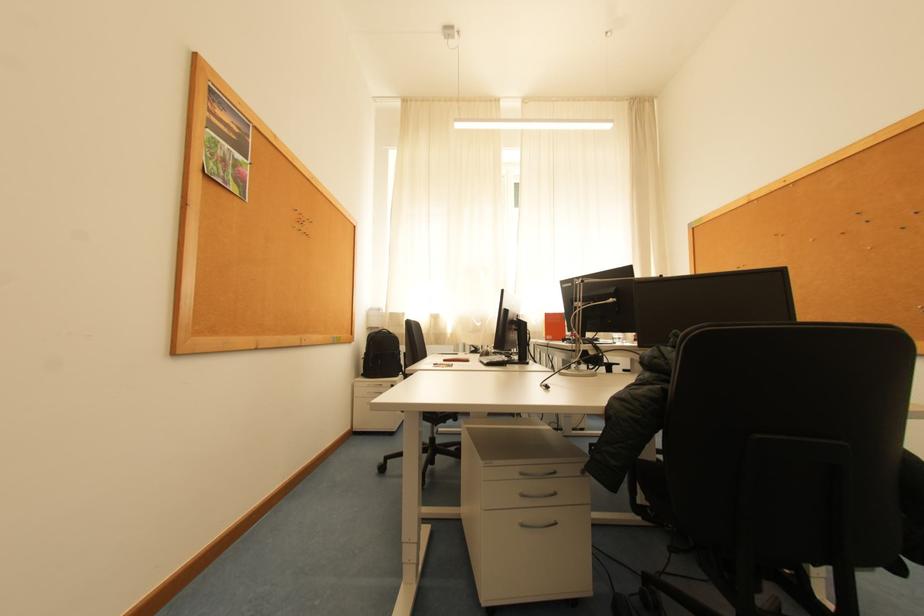
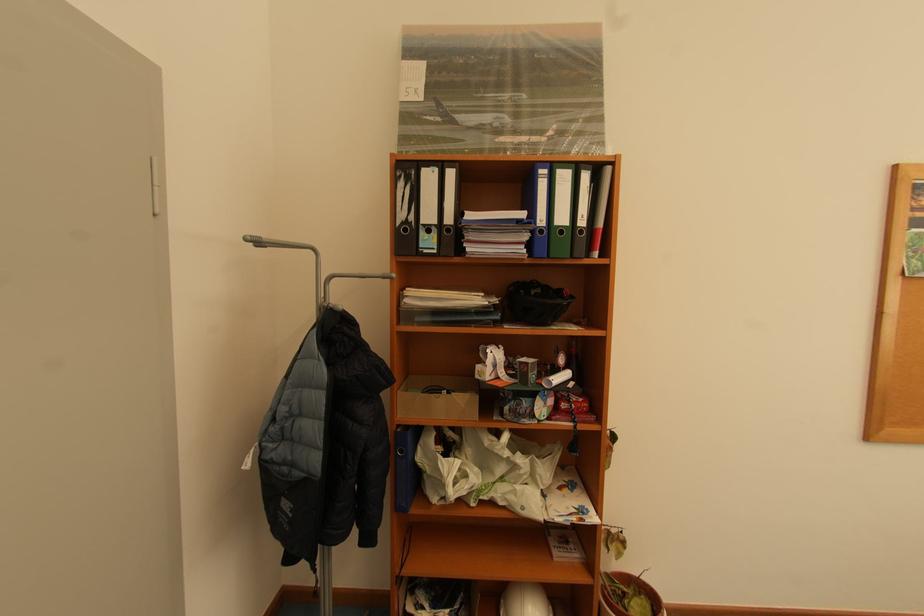
Question: How did the camera likely rotate?

Choices:
 (A) Left
 (B) Right
 (C) Up
 (D) Down

Answer: (A)